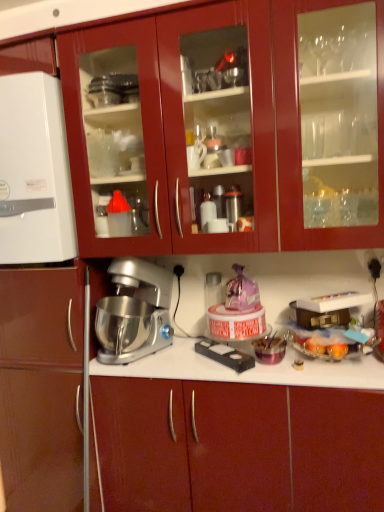
Question: From the image's perspective, is matte red cabinet at center, the 2th cabinetry positioned from the top, above or below glossy wood cabinets at upper center, arranged as the 2th cabinetry when ordered from the bottom?

Choices:
 (A) above
 (B) below

Answer: (B)

Question: Is point (259, 508) positioned closer to the camera than point (188, 174)?

Choices:
 (A) closer
 (B) farther

Answer: (B)

Question: Considering the real-world distances, which object is closest to the translucent plastic tray at right, acting as the 1th appliance starting from the right?

Choices:
 (A) glossy wood cabinets at upper center, the 1th cabinetry viewed from the top
 (B) silver metallic stand mixer at center
 (C) white matte refrigerator at left, which is the 2th appliance from bottom to top
 (D) matte red cabinet at center, the 1th cabinetry in the bottom-to-top sequence

Answer: (D)

Question: Which object is positioned farthest from the glossy wood cabinets at upper center, the 1th cabinetry viewed from the top?

Choices:
 (A) silver metallic stand mixer at center
 (B) white matte refrigerator at left, which is counted as the 1th appliance, starting from the top
 (C) matte red cabinet at center, the 2th cabinetry positioned from the top
 (D) translucent plastic tray at right, the 1th appliance ordered from the bottom

Answer: (C)